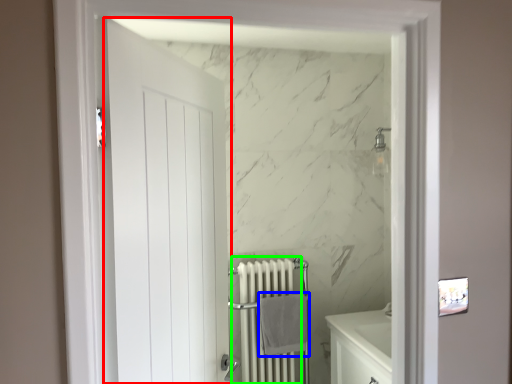
Question: Which object is the farthest from door (highlighted by a red box)? Choose among these: bath towel (highlighted by a blue box) or radiator (highlighted by a green box).

Choices:
 (A) bath towel
 (B) radiator

Answer: (B)